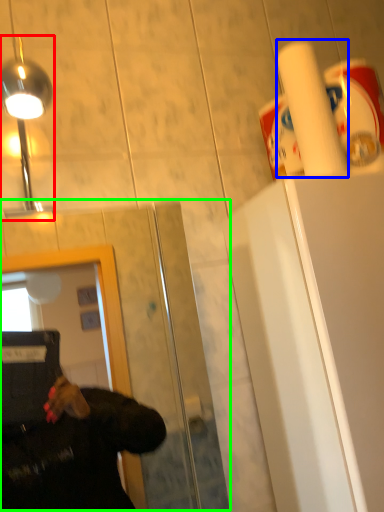
Question: Estimate the real-world distances between objects in this image. Which object is closer to light fixture (highlighted by a red box), paper towel (highlighted by a blue box) or glass door (highlighted by a green box)?

Choices:
 (A) paper towel
 (B) glass door

Answer: (A)